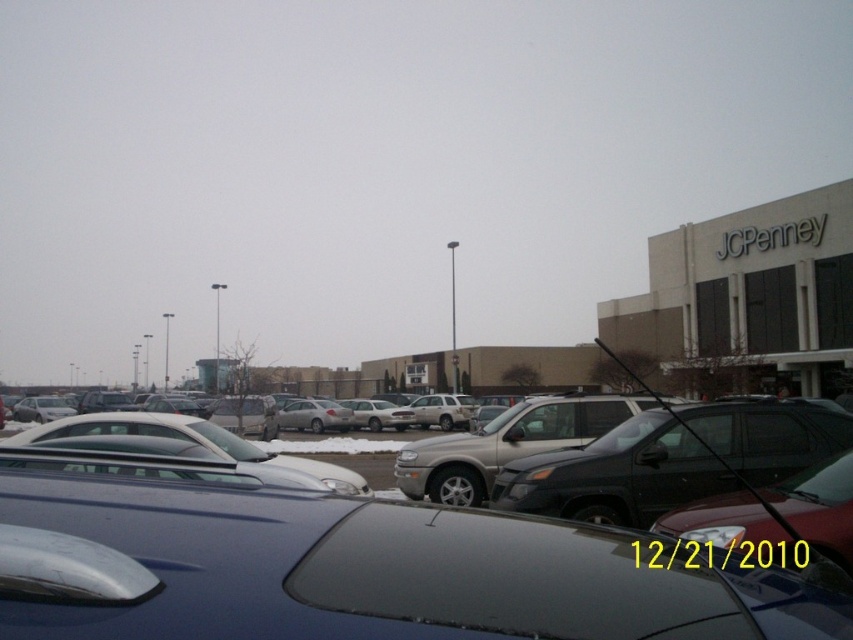
Does point (120, 531) come farther from viewer compared to point (610, 470)?

No.

Between shiny silver sedan at center and satin black suv at center, which one is positioned higher?

shiny silver sedan at center

What are the coordinates of `shiny silver sedan at center` in the screenshot? It's located at (361, 572).

Can you confirm if satin black suv at center is positioned to the right of satin silver suv at center?

Indeed, satin black suv at center is positioned on the right side of satin silver suv at center.

Is satin black suv at center thinner than satin silver suv at center?

Yes.

In order to click on satin black suv at center in this screenshot , I will do click(x=672, y=460).

Does shiny silver sedan at center have a lesser height compared to satin silver suv at center?

Yes, shiny silver sedan at center is shorter than satin silver suv at center.

Does shiny silver sedan at center appear on the right side of satin silver suv at center?

No, shiny silver sedan at center is not to the right of satin silver suv at center.

Locate an element on the screen. shiny silver sedan at center is located at coordinates (361, 572).